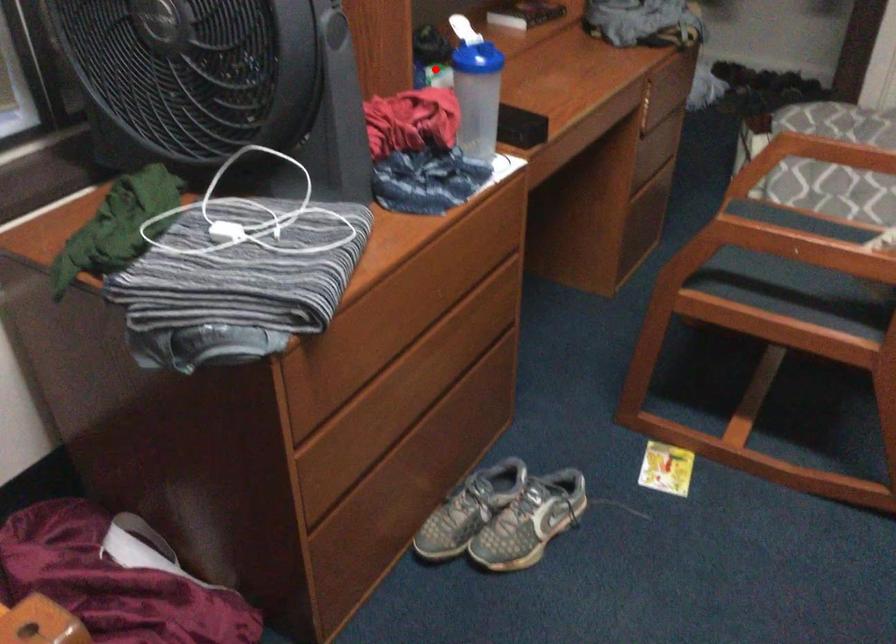
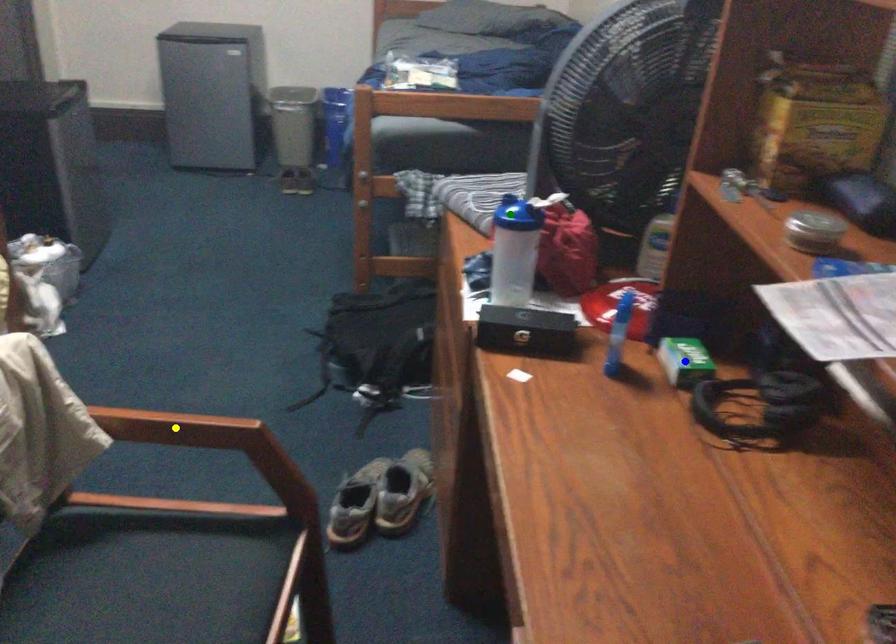
Question: I am providing you with two images of the same scene from different viewpoints. A red point is marked on the first image. You are given multiple points on the second image. In image 2, which mark is for the same physical point as the one in image 1?

Choices:
 (A) yellow point
 (B) blue point
 (C) green point

Answer: (B)